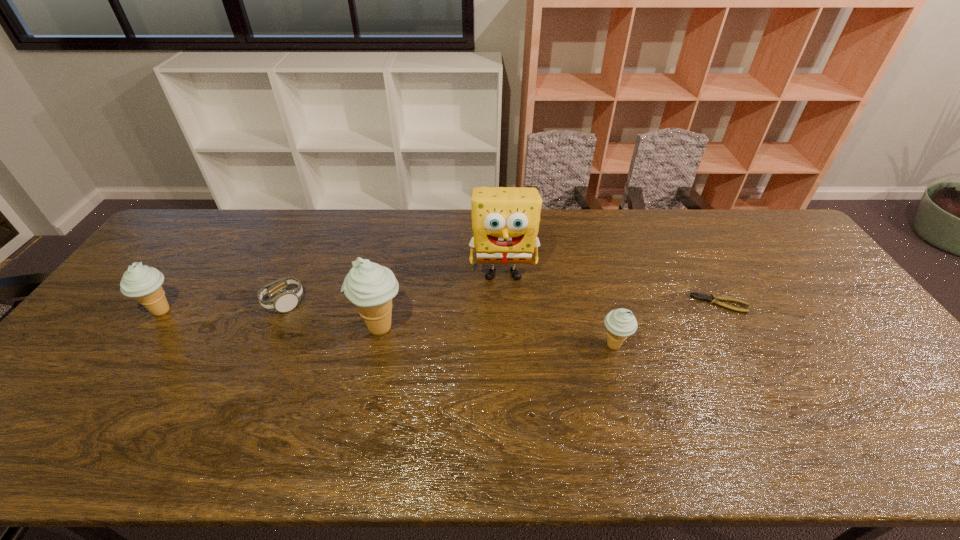
The height and width of the screenshot is (540, 960). Find the location of `free space between the watch and the shortest object`. free space between the watch and the shortest object is located at coordinates (502, 303).

Locate an element on the screen. free point between the second shortest object and the shortest object is located at coordinates 502,303.

Identify the location of object that is the fourth closest to the rightmost icecream. (286, 300).

Identify which object is the fifth nearest to the fourth shortest object. Please provide its 2D coordinates. Your answer should be formatted as a tuple, i.e. [(x, y)], where the tuple contains the x and y coordinates of a point satisfying the conditions above.

[(711, 298)]

Select which icecream is the second closest to the third object from left to right. Please provide its 2D coordinates. Your answer should be formatted as a tuple, i.e. [(x, y)], where the tuple contains the x and y coordinates of a point satisfying the conditions above.

[(620, 323)]

I want to click on icecream that stands as the second closest to the fifth object from left to right, so click(143, 283).

You are a GUI agent. You are given a task and a screenshot of the screen. Output one action in this format:
    pyautogui.click(x=<x>, y=<y>)
    Task: Click on the vacant area in the image that satisfies the following two spatial constraints: 1. on the face of the tallest icecream; 2. on the right side of the fifth object from right to left
    Image resolution: width=960 pixels, height=540 pixels.
    Given the screenshot: What is the action you would take?
    pyautogui.click(x=273, y=328)

This screenshot has width=960, height=540. In order to click on blank space that satisfies the following two spatial constraints: 1. on the face of the fifth tallest object; 2. on the left side of the rightmost object in this screenshot , I will do (x=283, y=303).

Identify the location of vacant area in the image that satisfies the following two spatial constraints: 1. on the front side of the third shortest object; 2. on the left side of the second shortest icecream. The image size is (960, 540). (137, 346).

This screenshot has height=540, width=960. Find the location of `vacant space that satisfies the following two spatial constraints: 1. on the front side of the leftmost object; 2. on the right side of the second object from right to left`. vacant space that satisfies the following two spatial constraints: 1. on the front side of the leftmost object; 2. on the right side of the second object from right to left is located at coordinates (137, 346).